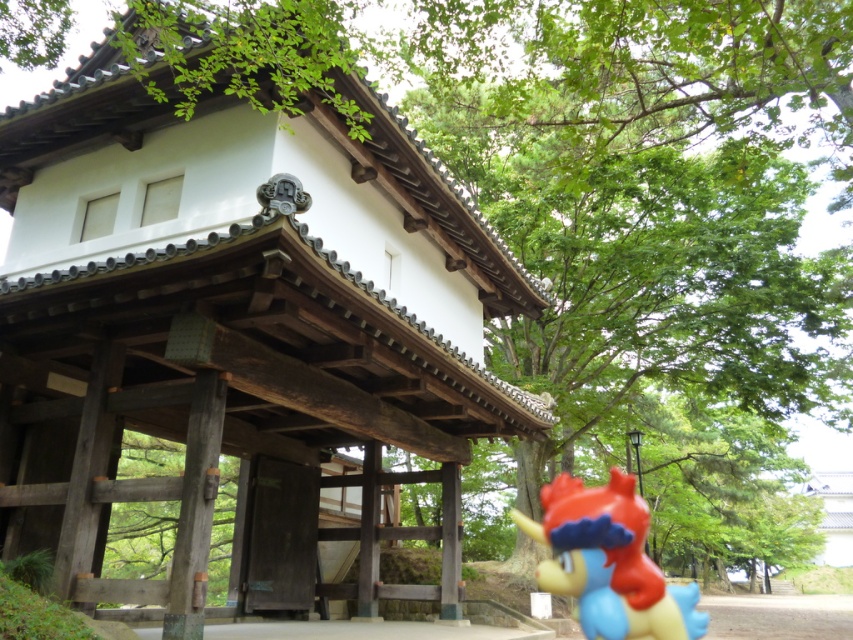
You are standing in front of a traditional Japanese gate surrounded by greenery. You need to locate the wooden gate at center precisely. What are its coordinates?

The wooden gate at center is located at coordinates point [241,332].

You are standing at the point marked as point (241, 332) in the image. What object is directly in front of you?

The wooden gate at center is located at point (241, 332), so the object directly in front of you is the wooden gate at center.